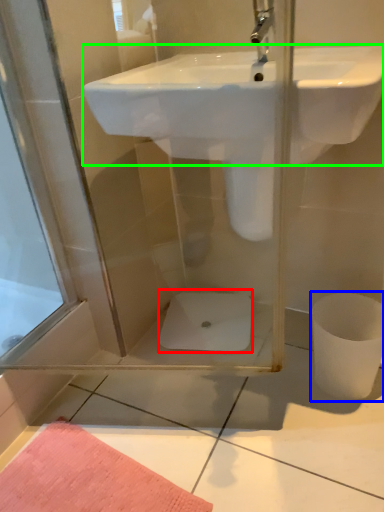
Question: Based on their relative distances, which object is farther from toilet bowl (highlighted by a red box)? Choose from toilet bowl (highlighted by a blue box) and sink (highlighted by a green box).

Choices:
 (A) toilet bowl
 (B) sink

Answer: (B)